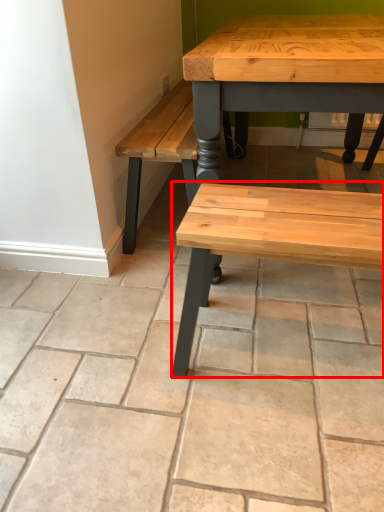
Question: Where is bench (annotated by the red box) located in relation to concrete in the image?

Choices:
 (A) left
 (B) right

Answer: (B)